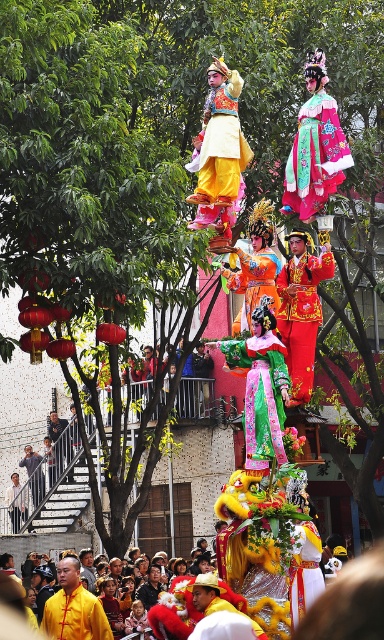
Does silky pink fabric at upper center appear under shiny orange fabric at center?

Incorrect, silky pink fabric at upper center is not positioned below shiny orange fabric at center.

Which of these two, silky pink fabric at upper center or shiny orange fabric at center, stands shorter?

With less height is shiny orange fabric at center.

Who is more forward, (326, 173) or (271, 264)?

Point (271, 264)

Locate an element on the screen. The height and width of the screenshot is (640, 384). silky pink fabric at upper center is located at coordinates (314, 147).

Is point (321, 161) positioned before point (284, 371)?

No, (321, 161) is behind (284, 371).

Does silky pink fabric at upper center appear on the left side of green satin dress at center?

In fact, silky pink fabric at upper center is to the right of green satin dress at center.

Locate an element on the screen. The image size is (384, 640). silky pink fabric at upper center is located at coordinates (314, 147).

Can you confirm if matte yellow costume at center is bigger than silky pink fabric at upper center?

Yes.

Does point (238, 147) lie in front of point (299, 160)?

That is True.

Does point (231, 74) come farther from viewer compared to point (329, 100)?

No.

You are a GUI agent. You are given a task and a screenshot of the screen. Output one action in this format:
    pyautogui.click(x=<x>, y=<y>)
    Task: Click on the matte yellow costume at center
    This screenshot has width=384, height=640.
    Given the screenshot: What is the action you would take?
    pyautogui.click(x=218, y=150)